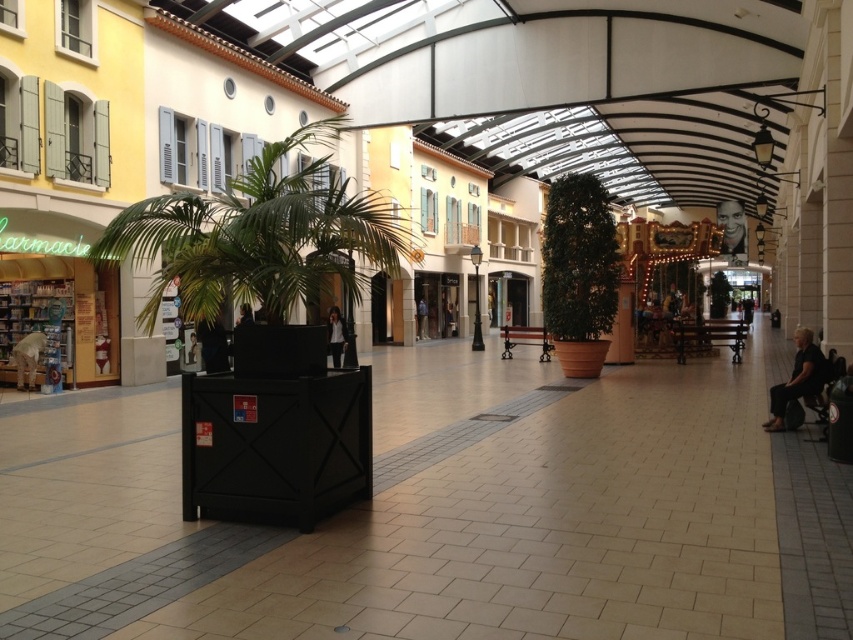
You are a customer entering the shopping arcade and see the black fabric chair at lower right and the smooth skin face at upper right. Which object is closer to you?

The black fabric chair at lower right is closer to you since it has a smaller size compared to the smooth skin face at upper right.

You are a customer entering the shopping arcade and want to sit down. You see a black fabric chair at lower right and a smooth skin face at upper right. Which object is narrower so you can fit through the space between them?

The black fabric chair at lower right is thinner than the smooth skin face at upper right, so the narrower object is the black fabric chair at lower right.